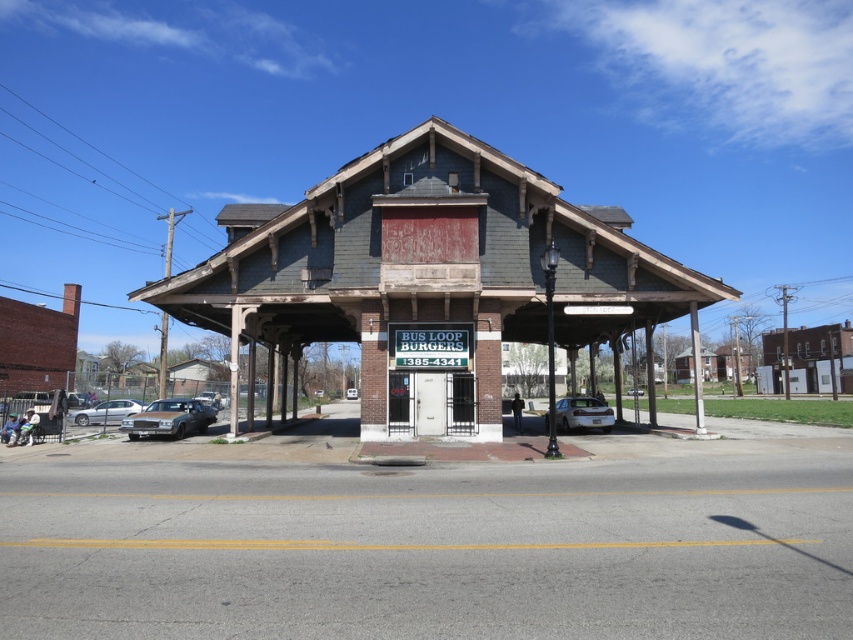
From the picture: Does brick building at center appear over shiny silver sedan at lower left?

Yes, brick building at center is above shiny silver sedan at lower left.

You are a GUI agent. You are given a task and a screenshot of the screen. Output one action in this format:
    pyautogui.click(x=<x>, y=<y>)
    Task: Click on the brick building at center
    This screenshot has width=853, height=640.
    Given the screenshot: What is the action you would take?
    pyautogui.click(x=428, y=275)

Between shiny silver sedan at lower left and silver metallic sedan at center, which one has more height?

Standing taller between the two is silver metallic sedan at center.

Is point (198, 422) positioned in front of point (352, 388)?

Yes, it is in front of point (352, 388).

Locate an element on the screen. The height and width of the screenshot is (640, 853). shiny silver sedan at lower left is located at coordinates (169, 419).

Which is more to the right, shiny silver sedan at lower left or silver metallic sedan at lower left?

shiny silver sedan at lower left is more to the right.

Which is behind, point (180, 401) or point (74, 417)?

The point (74, 417) is behind.

Is point (161, 410) in front of point (78, 419)?

Yes, it is in front of point (78, 419).

You are a GUI agent. You are given a task and a screenshot of the screen. Output one action in this format:
    pyautogui.click(x=<x>, y=<y>)
    Task: Click on the shiny silver sedan at lower left
    The width and height of the screenshot is (853, 640).
    Given the screenshot: What is the action you would take?
    pyautogui.click(x=169, y=419)